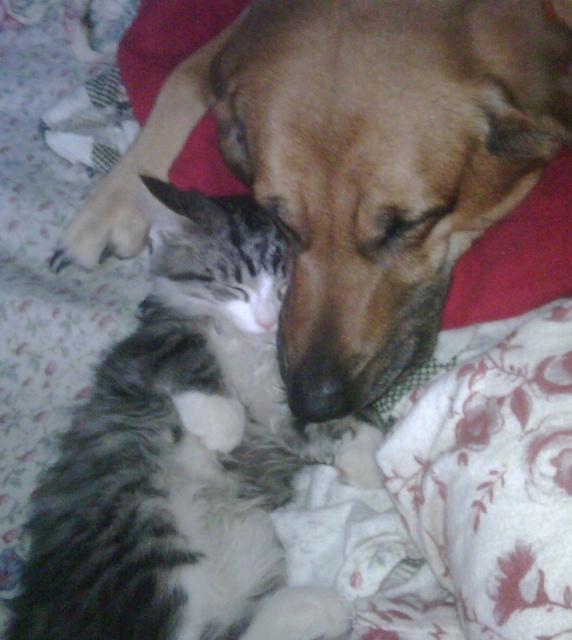
You are looking at the image of the sleeping dog and kitten. There are two points marked in the image. Which point, point (502, 44) or point (188, 404), is closer to you?

Point (502, 44) is closer to the viewer than point (188, 404).

You are a veterinarian examining the image of a brown matte dog at center and a tabby fur cat at center. Based on their positions, which animal is closer to the camera?

The brown matte dog at center is positioned over the tabby fur cat at center, meaning it is closer to the camera.